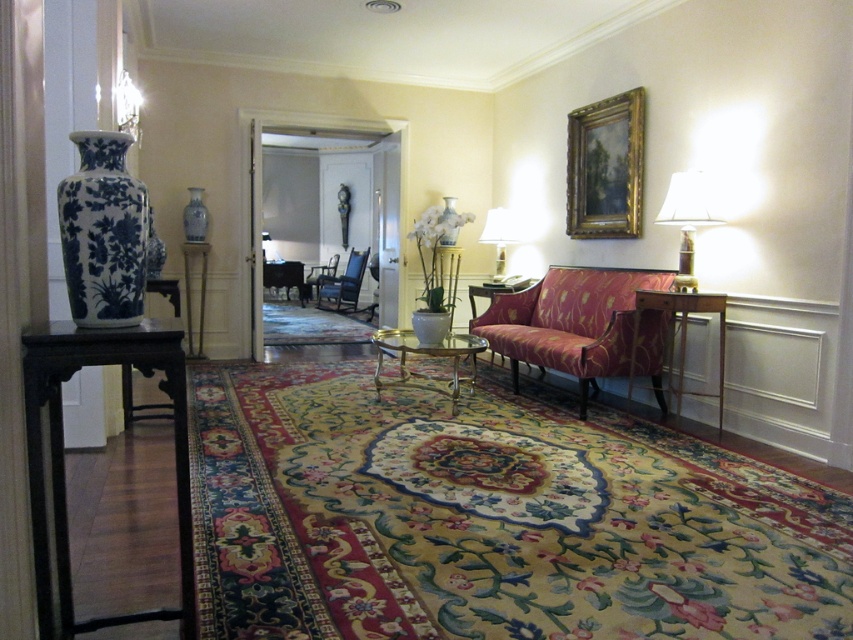
Who is more forward, (x=120, y=179) or (x=445, y=198)?

Positioned in front is point (x=120, y=179).

Is point (126, 307) farther from camera compared to point (445, 237)?

No, it is in front of (445, 237).

The image size is (853, 640). In order to click on blue porcelain vase at left in this screenshot , I will do `click(103, 232)`.

Is point (625, 104) closer to camera compared to point (456, 241)?

Yes, it is.

Is point (637, 118) farther from viewer compared to point (451, 237)?

No, (637, 118) is closer to viewer.

Is point (642, 102) behind point (440, 220)?

That is False.

You are a GUI agent. You are given a task and a screenshot of the screen. Output one action in this format:
    pyautogui.click(x=<x>, y=<y>)
    Task: Click on the gold/gilded picture frame at upper right
    
    Given the screenshot: What is the action you would take?
    pyautogui.click(x=605, y=168)

Between blue fabric armchair at center and metallic silver tray at center, which one is positioned lower?

blue fabric armchair at center is below.

Between blue fabric armchair at center and metallic silver tray at center, which one appears on the right side from the viewer's perspective?

blue fabric armchair at center is more to the right.

You are a GUI agent. You are given a task and a screenshot of the screen. Output one action in this format:
    pyautogui.click(x=<x>, y=<y>)
    Task: Click on the blue fabric armchair at center
    This screenshot has height=640, width=853.
    Given the screenshot: What is the action you would take?
    pyautogui.click(x=343, y=284)